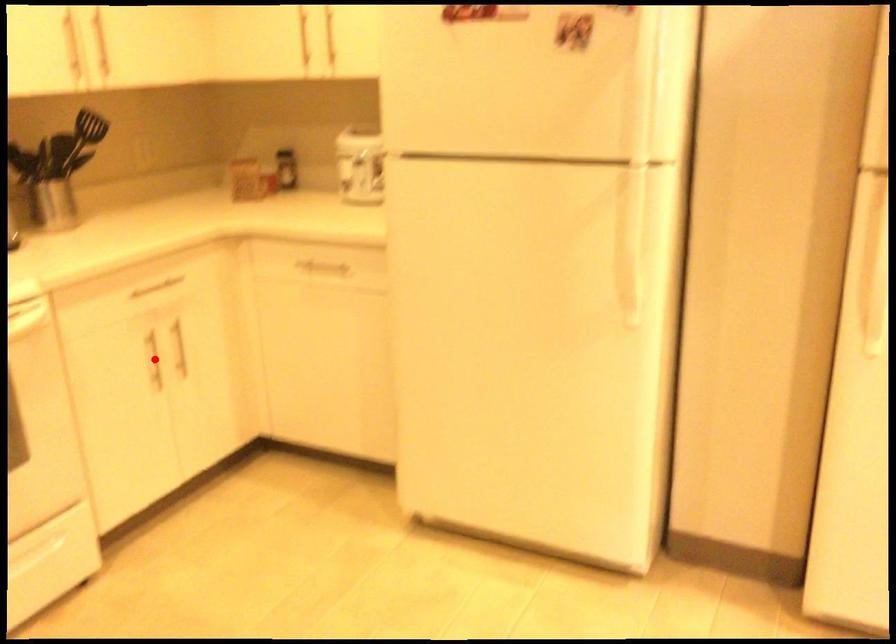
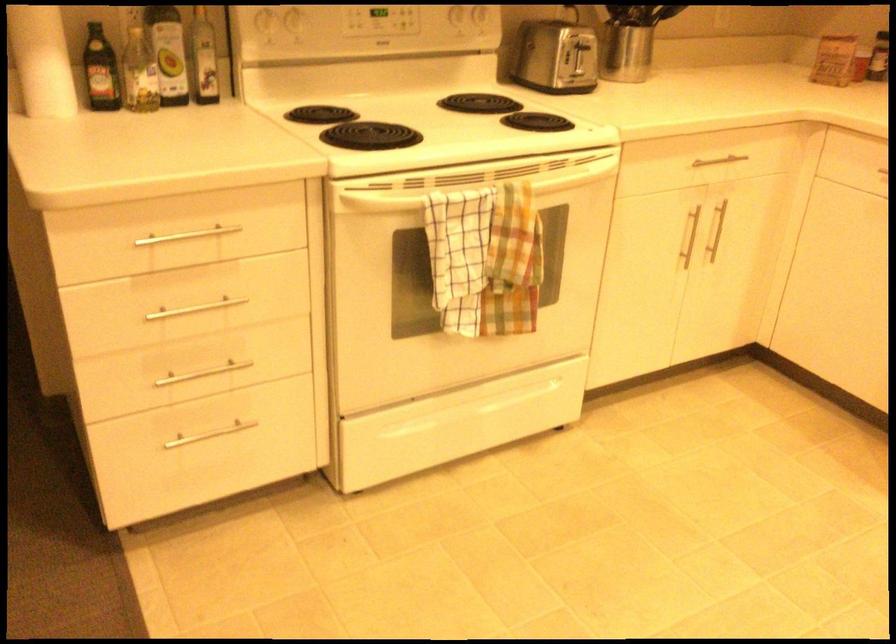
In the second image, find the point that corresponds to the highlighted location in the first image.

(687, 237)